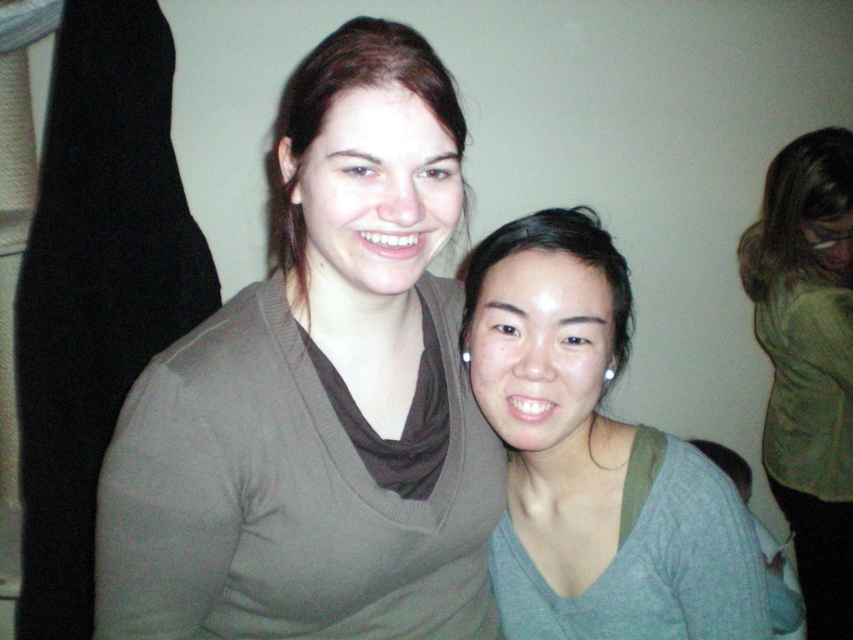
You are a photographer trying to adjust the lighting for a portrait. You notice the gray matte sweater at center and the matte brown hair at upper center. Which object should you focus on if you want to ensure the wider area is properly lit?

The gray matte sweater at center should be focused on because its width is larger than the matte brown hair at upper center, making it the wider area to light.